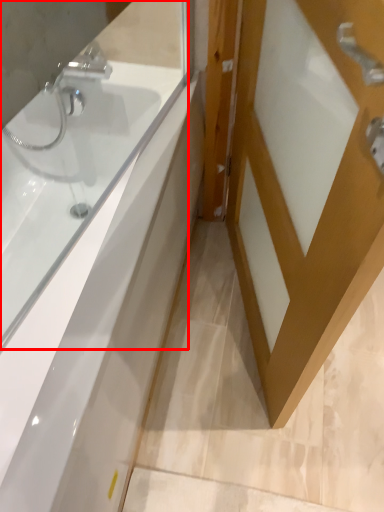
Question: Considering the relative positions of bathtub (annotated by the red box) and door in the image provided, where is bathtub (annotated by the red box) located with respect to the staircase?

Choices:
 (A) left
 (B) right

Answer: (A)